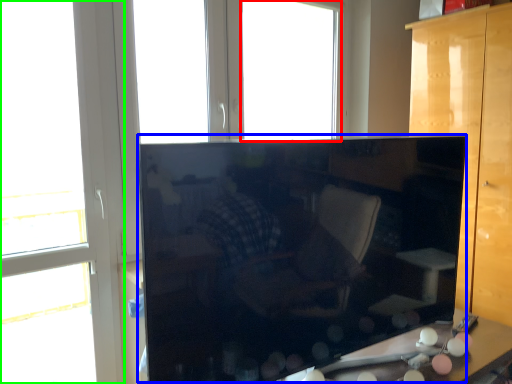
Question: Based on their relative distances, which object is farther from window (highlighted by a red box)? Choose from cabinetry (highlighted by a blue box) and window (highlighted by a green box).

Choices:
 (A) cabinetry
 (B) window

Answer: (A)